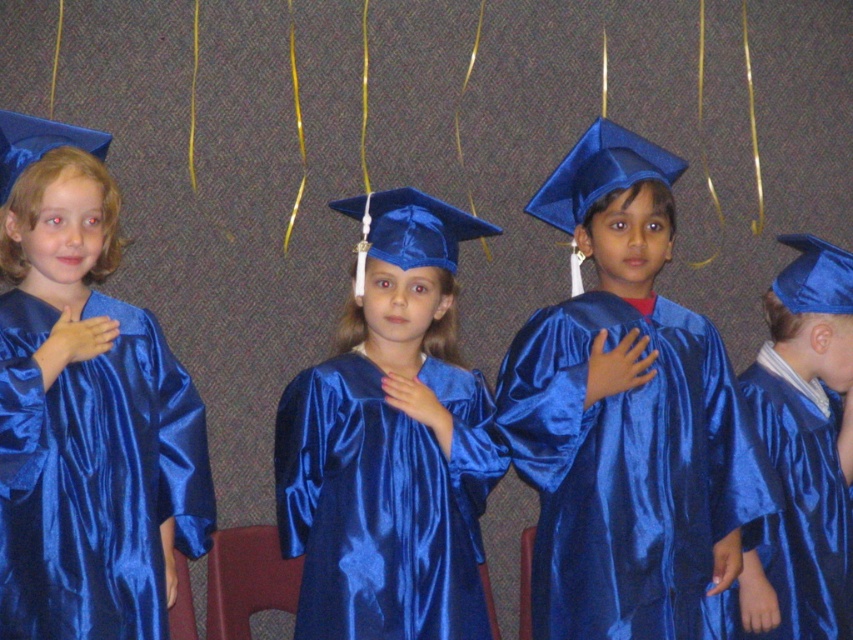
Question: Observing the image, what is the correct spatial positioning of shiny blue gown at center in reference to satin blue gown at center?

Choices:
 (A) right
 (B) left

Answer: (A)

Question: Which point is closer to the camera?

Choices:
 (A) (131, 307)
 (B) (606, 497)

Answer: (A)

Question: Can you confirm if satin blue gown at center is smaller than blue satin cap at upper right?

Choices:
 (A) yes
 (B) no

Answer: (B)

Question: Which object appears farthest from the camera in this image?

Choices:
 (A) shiny blue gown at center
 (B) satin blue gown at center
 (C) shiny blue graduation gown at center

Answer: (C)

Question: Does shiny blue gown at center have a smaller size compared to blue satin cap at upper right?

Choices:
 (A) no
 (B) yes

Answer: (A)

Question: Which object is positioned farthest from the satin blue gown at left?

Choices:
 (A) satin blue gown at center
 (B) shiny blue graduation gown at center
 (C) blue satin cap at upper right
 (D) shiny blue gown at center

Answer: (C)